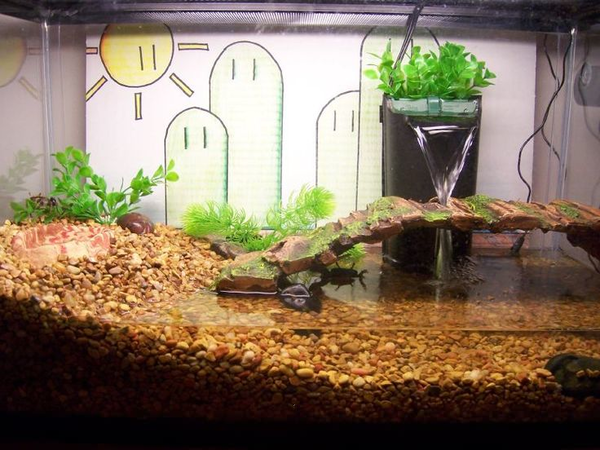
You are a GUI agent. You are given a task and a screenshot of the screen. Output one action in this format:
    pyautogui.click(x=<x>, y=<y>)
    Task: Click on the aquarium
    
    Given the screenshot: What is the action you would take?
    pyautogui.click(x=384, y=355)